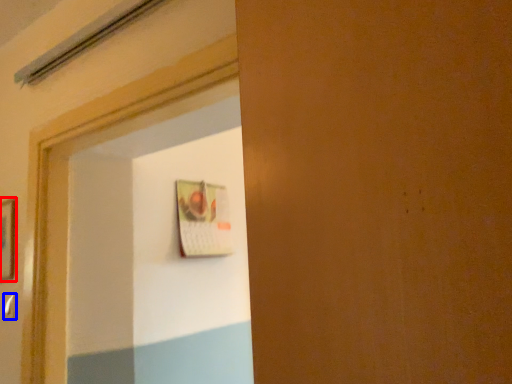
Question: Which point is further to the camera, picture frame (highlighted by a red box) or door handle (highlighted by a blue box)?

Choices:
 (A) picture frame
 (B) door handle

Answer: (A)